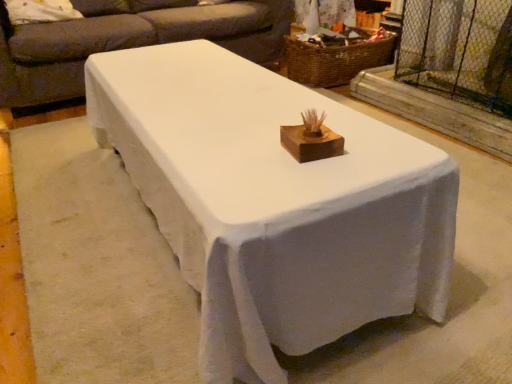
Question: Is the depth of woven brown basket at upper center greater than that of clear plastic screen door at upper right?

Choices:
 (A) yes
 (B) no

Answer: (A)

Question: Does woven brown basket at upper center appear on the right side of clear plastic screen door at upper right?

Choices:
 (A) no
 (B) yes

Answer: (A)

Question: From the image's perspective, would you say woven brown basket at upper center is shown under clear plastic screen door at upper right?

Choices:
 (A) yes
 (B) no

Answer: (B)

Question: Is woven brown basket at upper center wider than clear plastic screen door at upper right?

Choices:
 (A) yes
 (B) no

Answer: (A)

Question: Is woven brown basket at upper center placed right next to clear plastic screen door at upper right?

Choices:
 (A) no
 (B) yes

Answer: (A)

Question: In terms of height, does matte gray couch at upper center look taller or shorter compared to clear plastic screen door at upper right?

Choices:
 (A) short
 (B) tall

Answer: (B)

Question: From the image's perspective, is matte gray couch at upper center above or below clear plastic screen door at upper right?

Choices:
 (A) below
 (B) above

Answer: (B)

Question: Considering the positions of point (145, 43) and point (454, 44), is point (145, 43) closer or farther from the camera than point (454, 44)?

Choices:
 (A) farther
 (B) closer

Answer: (A)

Question: Choose the correct answer: Is matte gray couch at upper center inside clear plastic screen door at upper right or outside it?

Choices:
 (A) inside
 (B) outside

Answer: (B)

Question: From the image's perspective, is white painted wood table at center located above or below matte gray couch at upper center?

Choices:
 (A) above
 (B) below

Answer: (B)

Question: Considering the relative positions of white painted wood table at center and matte gray couch at upper center in the image provided, is white painted wood table at center to the left or to the right of matte gray couch at upper center?

Choices:
 (A) left
 (B) right

Answer: (B)

Question: Considering the positions of white painted wood table at center and matte gray couch at upper center in the image, is white painted wood table at center taller or shorter than matte gray couch at upper center?

Choices:
 (A) tall
 (B) short

Answer: (B)

Question: From a real-world perspective, is white painted wood table at center above or below matte gray couch at upper center?

Choices:
 (A) below
 (B) above

Answer: (A)

Question: Considering the positions of white painted wood table at center and woven brown basket at upper center in the image, is white painted wood table at center wider or thinner than woven brown basket at upper center?

Choices:
 (A) thin
 (B) wide

Answer: (B)

Question: In the image, is white painted wood table at center positioned in front of or behind woven brown basket at upper center?

Choices:
 (A) behind
 (B) front

Answer: (B)